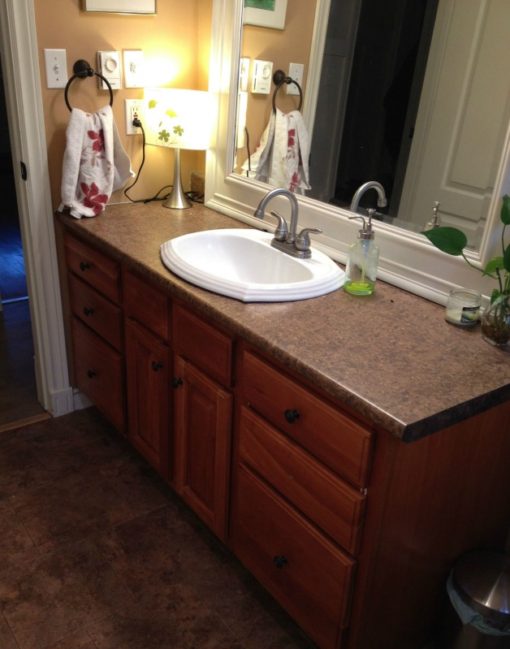
Find the location of a particular element. This screenshot has height=649, width=510. metal trash can is located at coordinates (478, 602).